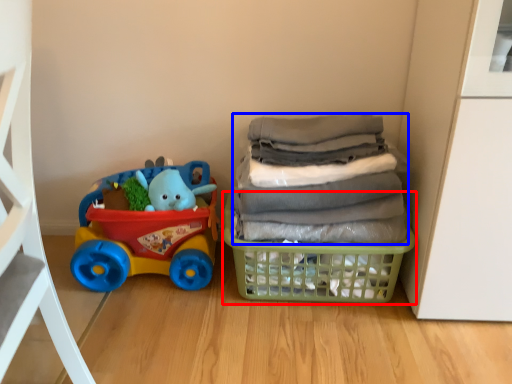
Question: Which point is further to the camera, basket (highlighted by a red box) or laundry (highlighted by a blue box)?

Choices:
 (A) basket
 (B) laundry

Answer: (A)